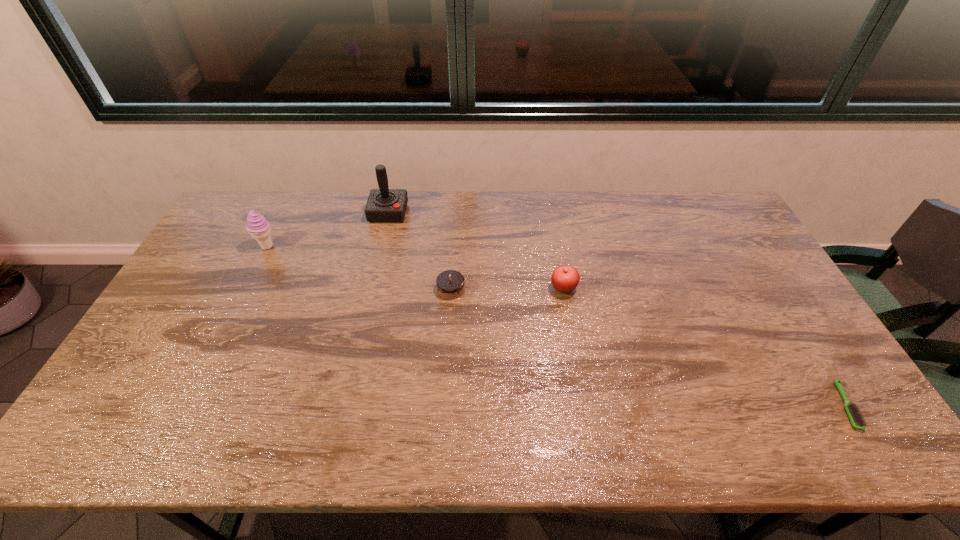
The image size is (960, 540). In order to click on free point at the near edge in this screenshot , I will do `click(542, 420)`.

Locate an element on the screen. free space at the left edge is located at coordinates (198, 286).

The height and width of the screenshot is (540, 960). Identify the location of vacant area at the right edge. (770, 284).

Where is `vacant area at the near left corner of the desktop`? This screenshot has height=540, width=960. vacant area at the near left corner of the desktop is located at coordinates (123, 441).

The height and width of the screenshot is (540, 960). I want to click on vacant region between the nearest object and the second object from right to left, so click(705, 347).

I want to click on free area in between the hairbrush and the apple, so click(x=705, y=347).

The height and width of the screenshot is (540, 960). Find the location of `empty space that is in between the third object from right to left and the second object from left to right`. empty space that is in between the third object from right to left and the second object from left to right is located at coordinates (420, 251).

What are the coordinates of `vacant space that is in between the third object from left to right and the apple` in the screenshot? It's located at (507, 289).

Identify the location of free space between the fourth nearest object and the tallest object. Image resolution: width=960 pixels, height=540 pixels. (328, 230).

Where is `free point between the hairbrush and the second farthest object`? This screenshot has width=960, height=540. free point between the hairbrush and the second farthest object is located at coordinates (557, 326).